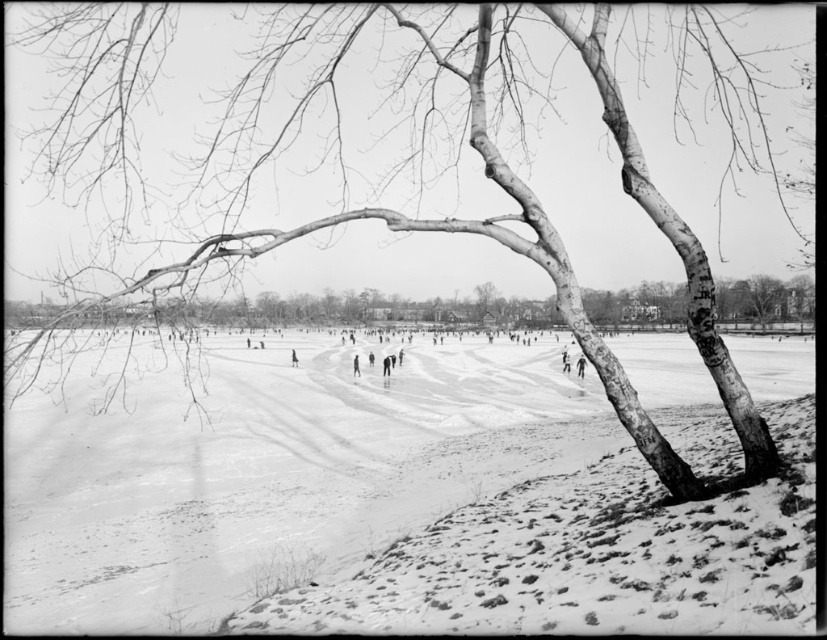
You are a photographer standing at the edge of the frozen lake. You want to capture a photo that includes both the white powdery snow at center and the smooth bark tree at center. Given that your camera has a maximum zoom range of 100 meters, will you be able to fit both objects into the frame without moving closer?

The distance between the white powdery snow at center and the smooth bark tree at center is 142.90 meters. Since your camera can only zoom up to 100 meters, you won cannot fit both objects into the frame without moving closer.

You are a photographer standing in the winter scene. You notice the white powdery snow at center and the smooth skin person at center. Which object is taller?

The white powdery snow at center is taller than the smooth skin person at center.

You are standing at the center of the frozen lake and want to reach the smooth bark tree at center. According to the coordinates provided, in which direction should you move to find it?

The smooth bark tree at center is located at coordinates point [371,308], which means it is slightly to the left and slightly below the exact center point of the image. Therefore, you should move slightly to the left and slightly downward from the center to reach it.